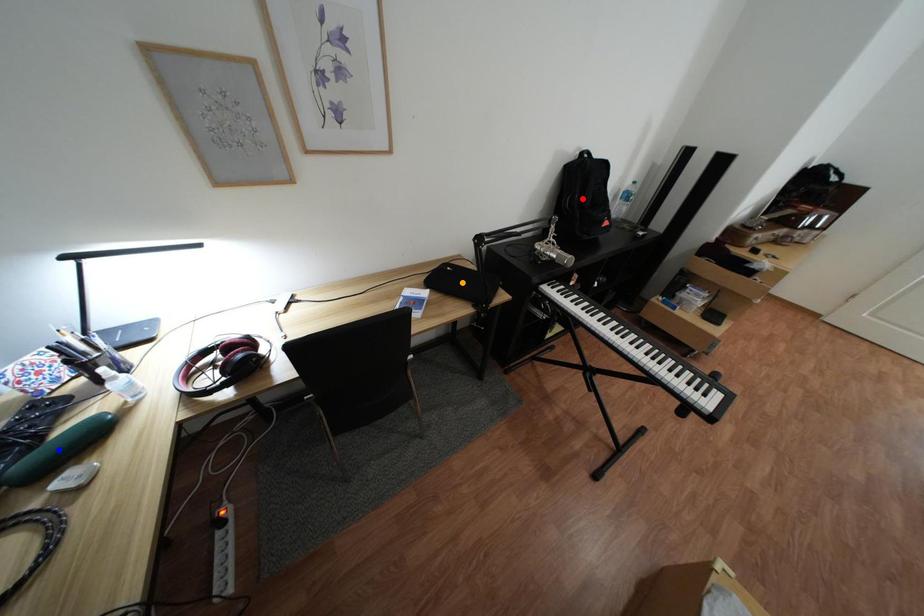
Order these from nearest to farthest:
1. red point
2. orange point
3. blue point

blue point, red point, orange point